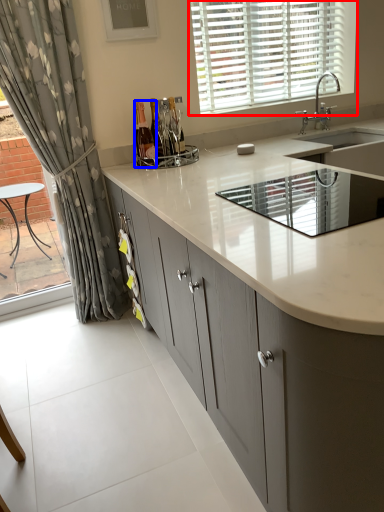
Question: Which point is further to the camera, window (highlighted by a red box) or bottle (highlighted by a blue box)?

Choices:
 (A) window
 (B) bottle

Answer: (A)